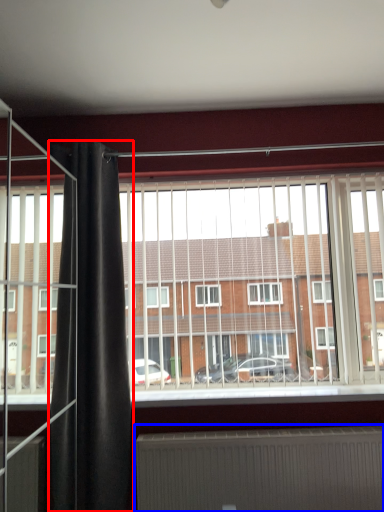
Question: Which point is further to the camera, shower curtain (highlighted by a red box) or radiator (highlighted by a blue box)?

Choices:
 (A) shower curtain
 (B) radiator

Answer: (B)